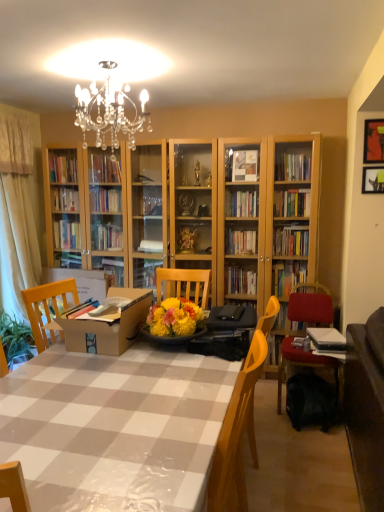
Question: Is point (147, 301) closer or farther from the camera than point (369, 132)?

Choices:
 (A) farther
 (B) closer

Answer: (B)

Question: Considering the positions of brown cardboard box at center and metallic gold picture frame at upper right, the 1th picture frame viewed from the top, in the image, is brown cardboard box at center taller or shorter than metallic gold picture frame at upper right, the 1th picture frame viewed from the top,?

Choices:
 (A) short
 (B) tall

Answer: (B)

Question: Considering the real-world distances, which object is closest to the velvet red chair at right?

Choices:
 (A) brown cardboard box at center
 (B) metallic silver picture frame at upper right, which ranks as the 1th picture frame in bottom-to-top order
 (C) white glossy table at center
 (D) black fabric backpack at lower right
 (E) beige fabric curtain at left

Answer: (D)

Question: Estimate the real-world distances between objects in this image. Which object is closer to the velvet red chair at right?

Choices:
 (A) black fabric backpack at lower right
 (B) white glossy table at center
 (C) metallic silver picture frame at upper right, placed as the second picture frame when sorted from top to bottom
 (D) brown cardboard box at center
 (E) metallic gold picture frame at upper right, the 1th picture frame viewed from the top

Answer: (A)